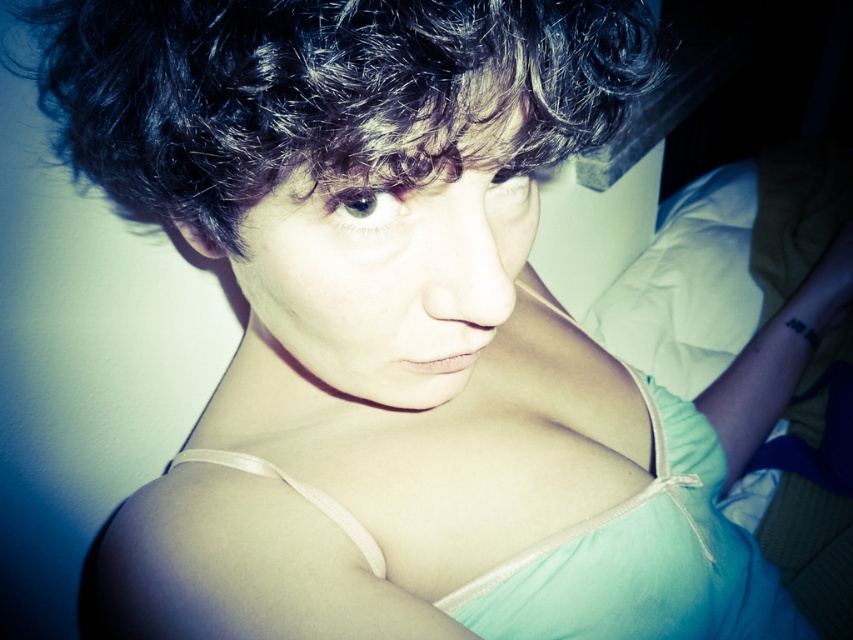
Does dark curly hair at upper center appear under light teal fabric dress at center?

No.

Is point (341, 140) in front of point (653, 531)?

Yes, it is.

Find the location of a particular element. The width and height of the screenshot is (853, 640). dark curly hair at upper center is located at coordinates (328, 93).

Image resolution: width=853 pixels, height=640 pixels. In order to click on smooth skin face at center in this screenshot , I will do `click(386, 276)`.

Does smooth skin face at center appear under light teal fabric dress at center?

Actually, smooth skin face at center is above light teal fabric dress at center.

The image size is (853, 640). I want to click on smooth skin face at center, so click(x=386, y=276).

Who is higher up, dark curly hair at upper center or smooth skin face at center?

dark curly hair at upper center is higher up.

Is point (390, 36) positioned in front of point (494, 269)?

Yes, point (390, 36) is closer to viewer.

Identify the location of dark curly hair at upper center. This screenshot has height=640, width=853. (328, 93).